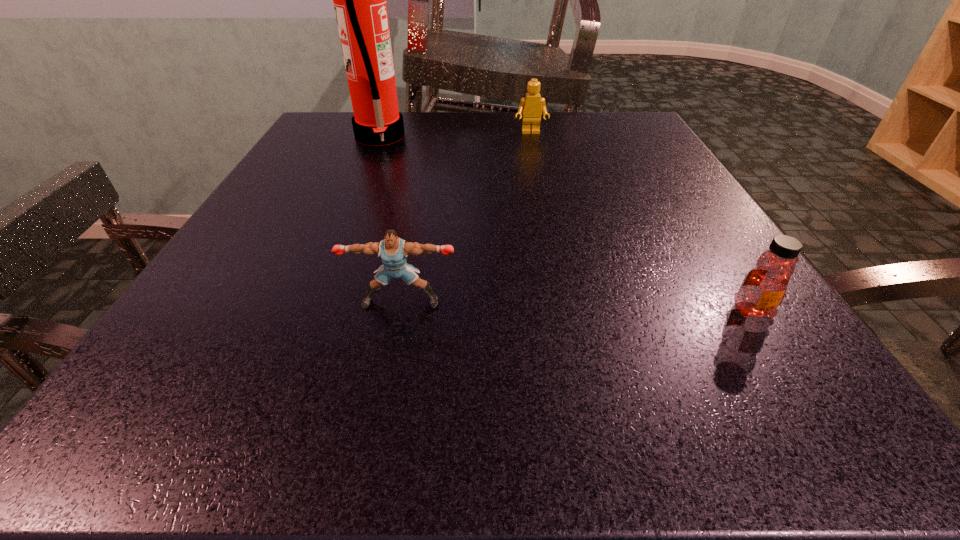
Where is `unoccupied position between the honey and the third object from left to right`? The width and height of the screenshot is (960, 540). unoccupied position between the honey and the third object from left to right is located at coordinates (641, 221).

Identify the location of free space between the fire extinguisher and the puncher. coord(390,219).

Image resolution: width=960 pixels, height=540 pixels. In order to click on free spot between the honey and the third object from left to right in this screenshot , I will do `click(641, 221)`.

Find the location of a particular element. Image resolution: width=960 pixels, height=540 pixels. unoccupied position between the puncher and the fire extinguisher is located at coordinates (390, 219).

Locate an element on the screen. This screenshot has height=540, width=960. unoccupied area between the honey and the fire extinguisher is located at coordinates (565, 224).

This screenshot has width=960, height=540. Find the location of `blank region between the puncher and the Lego`. blank region between the puncher and the Lego is located at coordinates (466, 217).

Where is `vacant space in between the fire extinguisher and the honey`? vacant space in between the fire extinguisher and the honey is located at coordinates (565, 224).

You are a GUI agent. You are given a task and a screenshot of the screen. Output one action in this format:
    pyautogui.click(x=<x>, y=<y>)
    Task: Click on the vacant area between the puncher and the third object from left to right
    
    Given the screenshot: What is the action you would take?
    pyautogui.click(x=466, y=217)

Locate an element on the screen. The width and height of the screenshot is (960, 540). free space between the puncher and the honey is located at coordinates (577, 306).

Locate an element on the screen. unoccupied position between the honey and the tallest object is located at coordinates (565, 224).